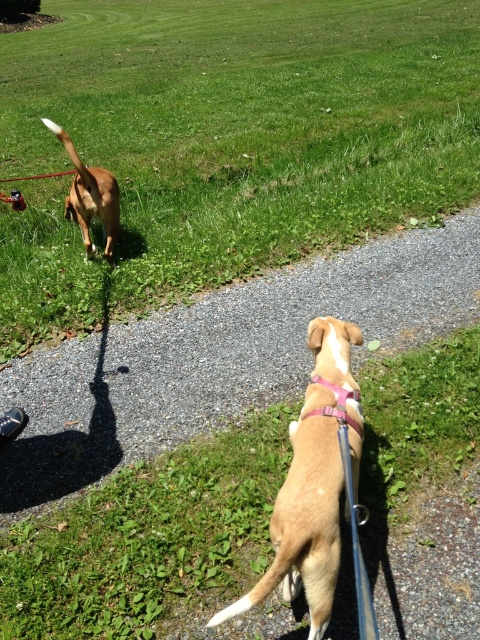
You are standing at the point with coordinates point (104, 211) and want to walk to the point with coordinates point (433, 212). Will you be moving forward or backward relative to your current position?

Since point (433, 212) is behind point (104, 211), you would be moving backward relative to your current position at point (104, 211).

You are a dog owner trying to decide where to let your dog off the leash. You see the green grass at upper center and the gravel path at center. Which area is above the other?

The green grass at upper center is positioned over the gravel path at center.

You are standing in the park and want to walk towards the green grass at upper center. Based on the coordinates provided, in which direction should you move relative to your current position?

The green grass at upper center is located at coordinates point (227,140), so you should move towards the upper center direction to reach it.